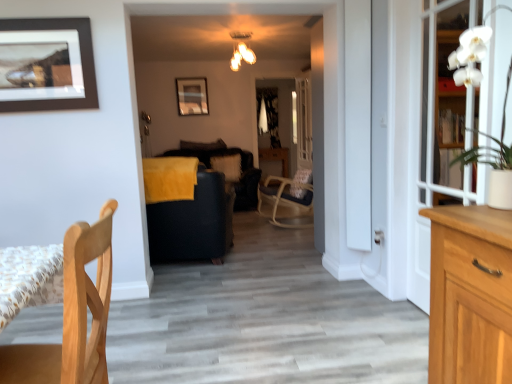
The height and width of the screenshot is (384, 512). I want to click on matte black picture frame at upper center, the 1th picture frame positioned from the top, so click(x=192, y=96).

Image resolution: width=512 pixels, height=384 pixels. Describe the element at coordinates (192, 96) in the screenshot. I see `matte black picture frame at upper center, the 1th picture frame positioned from the top` at that location.

I want to click on velvet black couch at center, so click(191, 218).

In the scene shown: Measure the distance between white fluffy pillow at center and camera.

The depth of white fluffy pillow at center is 18.44 feet.

Image resolution: width=512 pixels, height=384 pixels. Identify the location of brown matte picture frame at upper left, which appears as the 1th picture frame when ordered from the bottom. (46, 65).

Which object is thinner, clear glass door at center, which is the 2th glass door in right-to-left order, or velvet black couch at center?

clear glass door at center, which is the 2th glass door in right-to-left order.

From the picture: Which point is more distant from viewer, (308, 152) or (178, 158)?

Point (308, 152)

Is clear glass door at center, positioned as the first glass door in back-to-front order, positioned beyond the bounds of velvet black couch at center?

Yes, clear glass door at center, positioned as the first glass door in back-to-front order, is outside of velvet black couch at center.

Where is `houseplant above the clear glass door at center, which is the 2th glass door in right-to-left order (from a real-world perspective)`? This screenshot has height=384, width=512. houseplant above the clear glass door at center, which is the 2th glass door in right-to-left order (from a real-world perspective) is located at coordinates (494, 159).

Can we say clear glass door at center, which is the 2th glass door in right-to-left order, lies outside white ceramic vase at upper right?

Yes, clear glass door at center, which is the 2th glass door in right-to-left order, is located beyond the bounds of white ceramic vase at upper right.

What's the angular difference between clear glass door at center, the 1th glass door viewed from the left, and white ceramic vase at upper right's facing directions?

They differ by 5.08 degrees in their facing directions.

Is clear glass door at center, the 1th glass door viewed from the left, beside white ceramic vase at upper right?

No, clear glass door at center, the 1th glass door viewed from the left, is not beside white ceramic vase at upper right.

Are white glass door at right, the second glass door in the left-to-right sequence, and clear glass door at center, which is the 2th glass door in right-to-left order, far apart?

Yes, white glass door at right, the second glass door in the left-to-right sequence, is far from clear glass door at center, which is the 2th glass door in right-to-left order.

There is a white glass door at right, which appears as the second glass door when viewed from the back. Identify the location of glass door above it (from a real-world perspective). (303, 122).

Is white glass door at right, which is the 1th glass door from front to back, facing towards clear glass door at center, which is the 2th glass door in right-to-left order?

No, white glass door at right, which is the 1th glass door from front to back, does not turn towards clear glass door at center, which is the 2th glass door in right-to-left order.

From the image's perspective, is white glass door at right, the second glass door in the left-to-right sequence, positioned above or below clear glass door at center, positioned as the first glass door in back-to-front order?

Based on their image positions, white glass door at right, the second glass door in the left-to-right sequence, is located beneath clear glass door at center, positioned as the first glass door in back-to-front order.

Based on their sizes in the image, would you say white ceramic vase at upper right is bigger or smaller than clear glass door at center, positioned as the 2th glass door in front-to-back order?

In the image, white ceramic vase at upper right appears to be smaller than clear glass door at center, positioned as the 2th glass door in front-to-back order.

Is white ceramic vase at upper right not inside clear glass door at center, positioned as the 2th glass door in front-to-back order?

Yes, white ceramic vase at upper right is located beyond the bounds of clear glass door at center, positioned as the 2th glass door in front-to-back order.

Is white ceramic vase at upper right closer to the viewer compared to clear glass door at center, positioned as the 2th glass door in front-to-back order?

Yes, white ceramic vase at upper right is closer to the viewer.

Is white ceramic vase at upper right in contact with clear glass door at center, positioned as the 2th glass door in front-to-back order?

There is a gap between white ceramic vase at upper right and clear glass door at center, positioned as the 2th glass door in front-to-back order.

Is metallic glass chandelier at upper center positioned beyond the bounds of matte black picture frame at upper center, arranged as the 2th picture frame when viewed from the front?

Yes, metallic glass chandelier at upper center is outside of matte black picture frame at upper center, arranged as the 2th picture frame when viewed from the front.

Considering the positions of objects metallic glass chandelier at upper center and matte black picture frame at upper center, arranged as the 2th picture frame when viewed from the front, in the image provided, who is in front, metallic glass chandelier at upper center or matte black picture frame at upper center, arranged as the 2th picture frame when viewed from the front,?

metallic glass chandelier at upper center is closer to the camera.

Does metallic glass chandelier at upper center have a lesser height compared to matte black picture frame at upper center, the 1th picture frame positioned from the top?

Correct, metallic glass chandelier at upper center is not as tall as matte black picture frame at upper center, the 1th picture frame positioned from the top.

Is metallic glass chandelier at upper center thinner than matte black picture frame at upper center, the second picture frame ordered from the bottom?

No.

Is white glass door at right, the second glass door in the left-to-right sequence, facing away from brown matte picture frame at upper left, which appears as the 1th picture frame when ordered from the bottom?

No, brown matte picture frame at upper left, which appears as the 1th picture frame when ordered from the bottom, is not at the back of white glass door at right, the second glass door in the left-to-right sequence.

Measure the distance between white glass door at right, which is the 1th glass door from front to back, and brown matte picture frame at upper left, positioned as the first picture frame in front-to-back order.

white glass door at right, which is the 1th glass door from front to back, and brown matte picture frame at upper left, positioned as the first picture frame in front-to-back order, are 2.40 meters apart from each other.

Is white glass door at right, the second glass door in the left-to-right sequence, thinner than brown matte picture frame at upper left, the second picture frame when ordered from top to bottom?

No.

Who is bigger, white glass door at right, which is the 1th glass door from front to back, or brown matte picture frame at upper left, positioned as the first picture frame in front-to-back order?

Bigger between the two is white glass door at right, which is the 1th glass door from front to back.

Is there a large distance between white glass door at right, which appears as the second glass door when viewed from the back, and white fluffy pillow at center?

Indeed, white glass door at right, which appears as the second glass door when viewed from the back, is not near white fluffy pillow at center.

Is white fluffy pillow at center inside white glass door at right, which appears as the second glass door when viewed from the back?

No, white fluffy pillow at center is located outside of white glass door at right, which appears as the second glass door when viewed from the back.

From the image's perspective, is white glass door at right, the first glass door in the right-to-left sequence, located above or below white fluffy pillow at center?

Based on their image positions, white glass door at right, the first glass door in the right-to-left sequence, is located beneath white fluffy pillow at center.

From a real-world perspective, relative to white fluffy pillow at center, is white glass door at right, which appears as the second glass door when viewed from the back, vertically above or below?

white glass door at right, which appears as the second glass door when viewed from the back, is above white fluffy pillow at center.

Identify the location of glass door that is the 2nd one when counting upward from the velvet black couch at center (from the image's perspective). Image resolution: width=512 pixels, height=384 pixels. (303, 122).

The width and height of the screenshot is (512, 384). In order to click on glass door lying on the left of white ceramic vase at upper right in this screenshot , I will do `click(303, 122)`.

Based on their spatial positions, is metallic glass chandelier at upper center or white glass door at right, which appears as the second glass door when viewed from the back, further from velvet black couch at center?

Based on the image, metallic glass chandelier at upper center appears to be further to velvet black couch at center.

From the image, which object appears to be farther from velvet black couch at center, white fluffy pillow at center or light brown wooden chair at lower left?

Based on the image, light brown wooden chair at lower left appears to be further to velvet black couch at center.

From the image, which object appears to be nearer to white fluffy pillow at center, light brown wooden chair at lower left or matte black picture frame at upper center, the 1th picture frame positioned from the top?

matte black picture frame at upper center, the 1th picture frame positioned from the top, is positioned closer to the anchor white fluffy pillow at center.

Looking at the image, which one is located closer to white ceramic vase at upper right, velvet black couch at center or metallic glass chandelier at upper center?

velvet black couch at center lies closer to white ceramic vase at upper right than the other object.

From the image, which object appears to be nearer to white ceramic vase at upper right, light brown wooden chair at lower left or matte black picture frame at upper center, the second picture frame ordered from the bottom?

The object closer to white ceramic vase at upper right is light brown wooden chair at lower left.

From the picture: Estimate the real-world distances between objects in this image. Which object is closer to matte black picture frame at upper center, the second picture frame ordered from the bottom, velvet black couch at center or brown matte picture frame at upper left, the second picture frame when ordered from top to bottom?

The object closer to matte black picture frame at upper center, the second picture frame ordered from the bottom, is velvet black couch at center.

Based on the photo, estimate the real-world distances between objects in this image. Which object is further from white ceramic vase at upper right, velvet black couch at center or white fluffy pillow at center?

white fluffy pillow at center.

Which object lies nearer to the anchor point white fluffy pillow at center, brown matte picture frame at upper left, the second picture frame when ordered from top to bottom, or clear glass door at center, positioned as the 2th glass door in front-to-back order?

Based on the image, clear glass door at center, positioned as the 2th glass door in front-to-back order, appears to be nearer to white fluffy pillow at center.

Locate an element on the screen. The height and width of the screenshot is (384, 512). glass door positioned between brown matte picture frame at upper left, which ranks as the second picture frame in back-to-front order, and white fluffy pillow at center from near to far is located at coordinates (303, 122).

Find the location of `glass door between light brown wooden chair at lower left and velvet black couch at center along the z-axis`. glass door between light brown wooden chair at lower left and velvet black couch at center along the z-axis is located at coordinates (446, 104).

This screenshot has height=384, width=512. Find the location of `picture frame located between white ceramic vase at upper right and clear glass door at center, positioned as the 2th glass door in front-to-back order, in the depth direction`. picture frame located between white ceramic vase at upper right and clear glass door at center, positioned as the 2th glass door in front-to-back order, in the depth direction is located at coordinates (46, 65).

Image resolution: width=512 pixels, height=384 pixels. I want to click on glass door between white glass door at right, which appears as the second glass door when viewed from the back, and white fluffy pillow at center, along the z-axis, so click(303, 122).